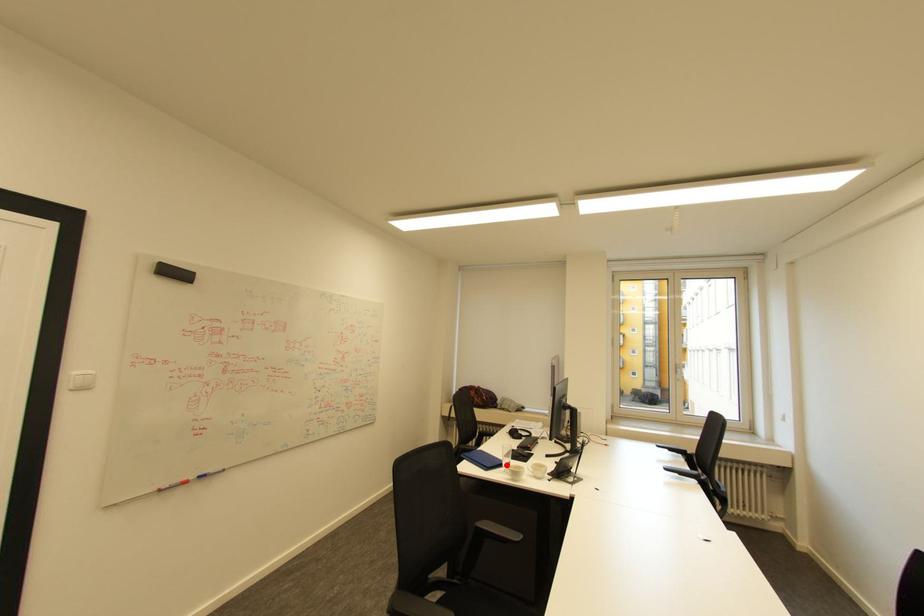
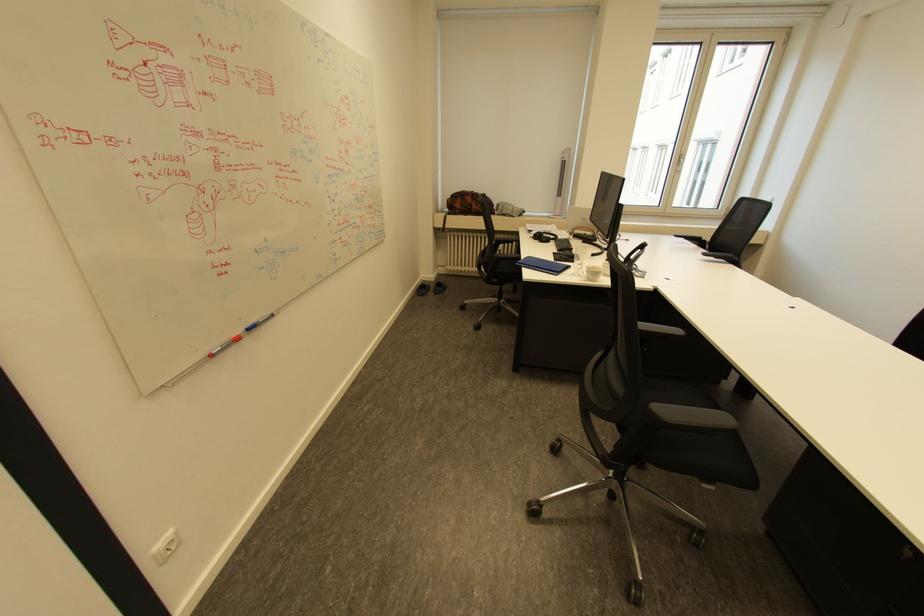
Where in the second image is the point corresponding to the highlighted location from the first image?

(575, 268)